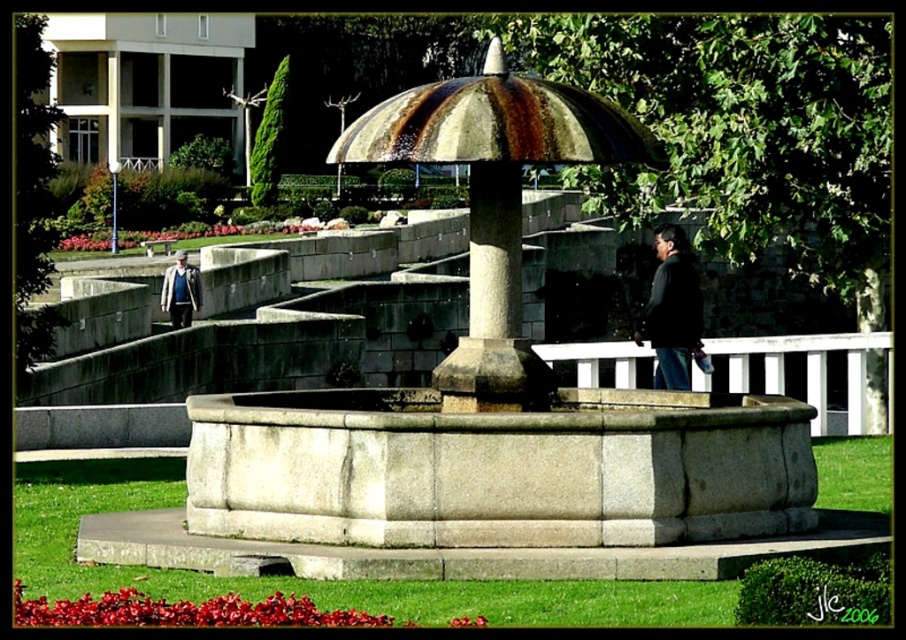
Question: Which object is positioned farthest from the dark blue jacket at center?

Choices:
 (A) dark gray jacket at center
 (B) rusty stone fountain at center

Answer: (B)

Question: Is dark gray jacket at center behind dark blue jacket at center?

Choices:
 (A) yes
 (B) no

Answer: (B)

Question: Among these points, which one is farthest from the camera?

Choices:
 (A) (182, 312)
 (B) (677, 260)
 (C) (476, 545)

Answer: (A)

Question: Is rusty stone fountain at center below dark gray jacket at center?

Choices:
 (A) no
 (B) yes

Answer: (B)

Question: Which of these objects is positioned farthest from the dark gray jacket at center?

Choices:
 (A) rusty stone fountain at center
 (B) dark blue jacket at center

Answer: (B)

Question: Can you confirm if rusty stone fountain at center is positioned below dark gray jacket at center?

Choices:
 (A) no
 (B) yes

Answer: (B)